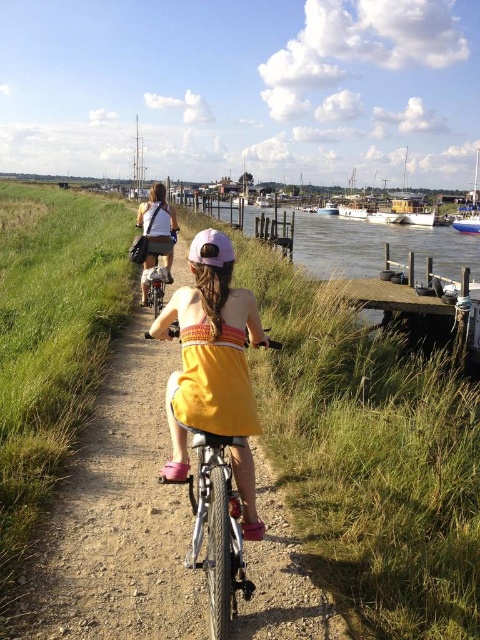
You are a photographer trying to capture a clear shot of the yellow cotton dress at center and the purple matte bicycle helmet at center. Which object would appear narrower in your photo?

The yellow cotton dress at center is thinner than the purple matte bicycle helmet at center, so it would appear narrower in the photo.